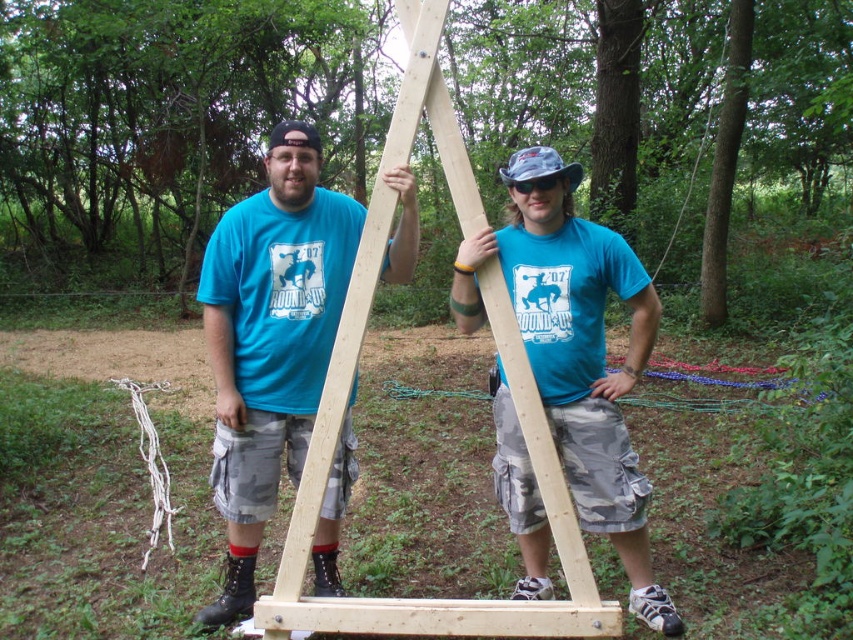
Question: From the image, what is the correct spatial relationship of matte blue t-shirt at center in relation to matte wood frame at center?

Choices:
 (A) above
 (B) below

Answer: (B)

Question: Which point is farther from the camera taking this photo?

Choices:
 (A) (601, 392)
 (B) (366, 259)

Answer: (A)

Question: In this image, where is matte blue t-shirt at center located relative to natural wood ladder at center?

Choices:
 (A) left
 (B) right

Answer: (A)

Question: Estimate the real-world distances between objects in this image. Which object is farther from the matte blue t-shirt at center?

Choices:
 (A) matte wood frame at center
 (B) natural wood ladder at center

Answer: (A)

Question: Can you confirm if matte wood frame at center is smaller than natural wood ladder at center?

Choices:
 (A) no
 (B) yes

Answer: (B)

Question: Which of these objects is positioned farthest from the natural wood ladder at center?

Choices:
 (A) matte wood frame at center
 (B) matte blue t-shirt at center

Answer: (A)